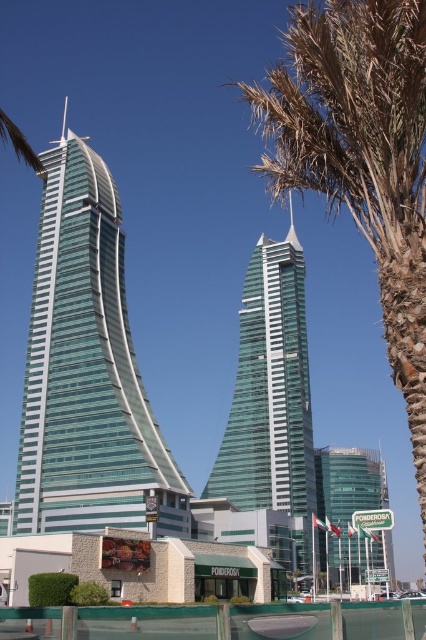
Question: Among these objects, which one is nearest to the camera?

Choices:
 (A) transparent glass tower at center
 (B) green glass building at center
 (C) translucent glass skyscraper at center

Answer: (C)

Question: From the image, what is the correct spatial relationship of transparent glass tower at center in relation to green glass building at center?

Choices:
 (A) left
 (B) right

Answer: (A)

Question: Is translucent glass skyscraper at center smaller than green leafy palm tree at upper right?

Choices:
 (A) no
 (B) yes

Answer: (B)

Question: Which is nearer to the translucent glass skyscraper at center?

Choices:
 (A) transparent glass tower at center
 (B) green glass building at center
 (C) green leafy palm tree at upper right

Answer: (A)

Question: Which point appears farthest from the camera in this image?

Choices:
 (A) (278, 376)
 (B) (271, 138)
 (C) (57, 148)
 (D) (365, 506)

Answer: (D)

Question: Is green leafy palm tree at upper right bigger than transparent glass tower at center?

Choices:
 (A) no
 (B) yes

Answer: (B)